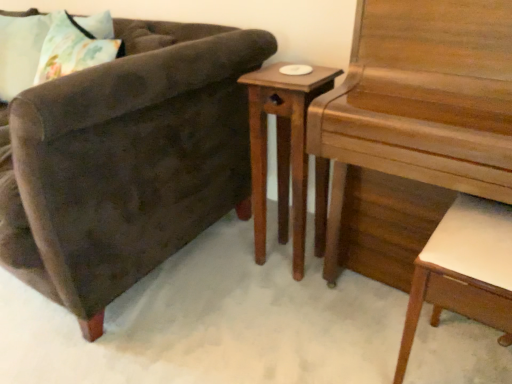
Find the location of `vacant area situated below wooden piano at right (from a real-world perspective)`. vacant area situated below wooden piano at right (from a real-world perspective) is located at coordinates (390, 307).